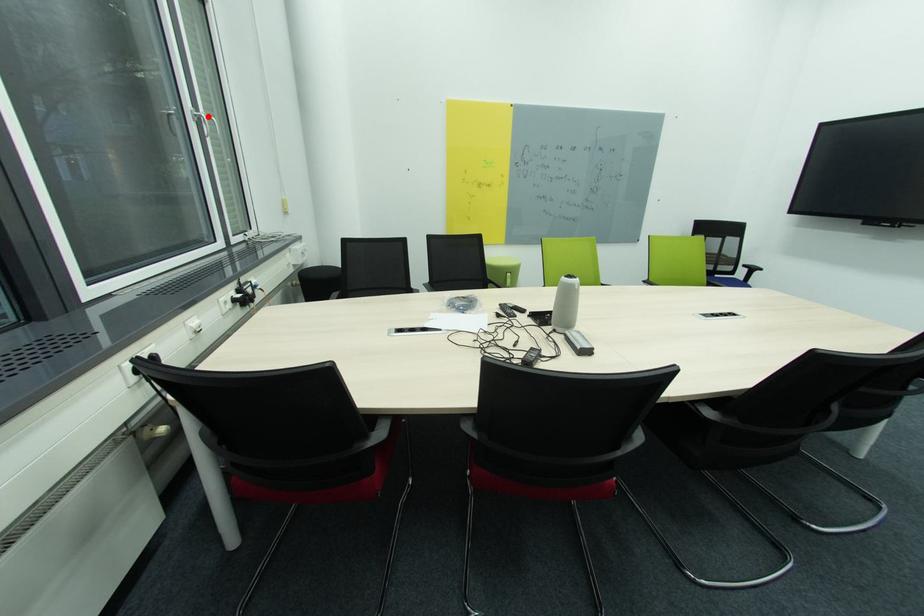
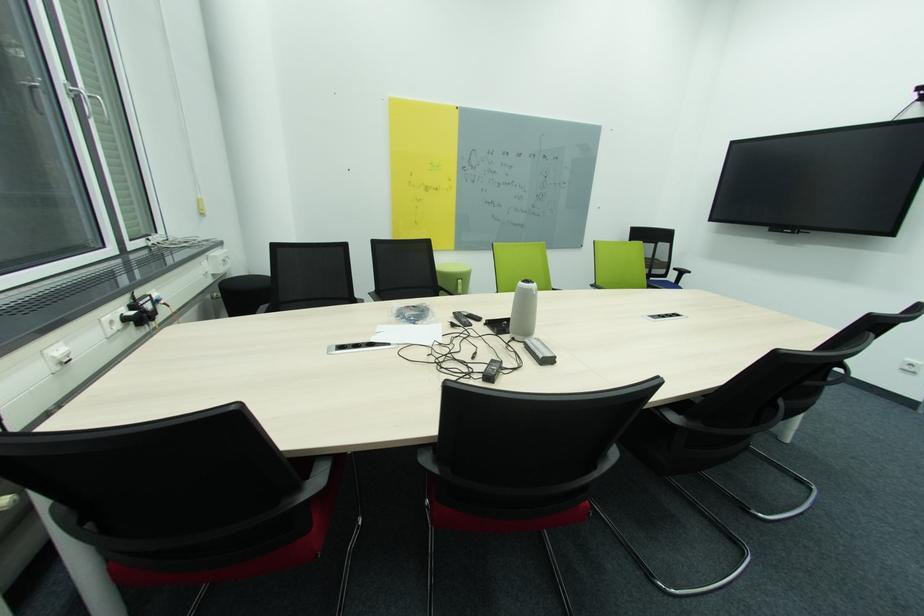
In the second image, find the point that corresponds to the highlighted location in the first image.

(88, 92)